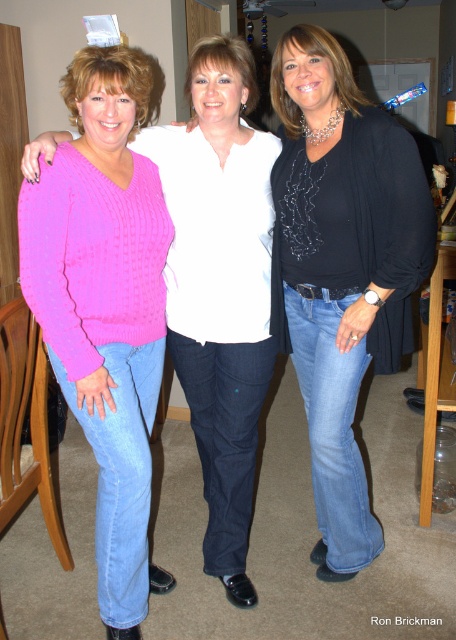
Is black matte shirt at center wider than pink knitted sweater at left?

Yes, black matte shirt at center is wider than pink knitted sweater at left.

From the picture: How distant is black matte shirt at center from pink knitted sweater at left?

black matte shirt at center and pink knitted sweater at left are 19.92 inches apart from each other.

Between point (309, 280) and point (124, 160), which one is positioned in front?

Point (124, 160) is more forward.

Image resolution: width=456 pixels, height=640 pixels. Identify the location of black matte shirt at center. click(342, 268).